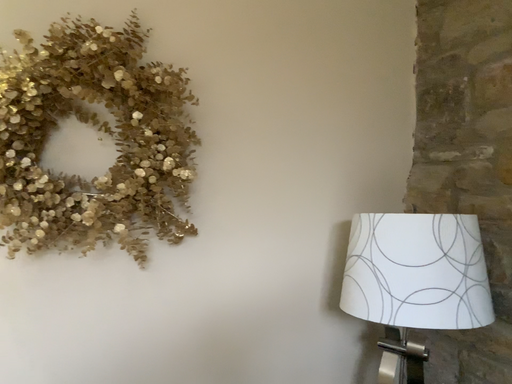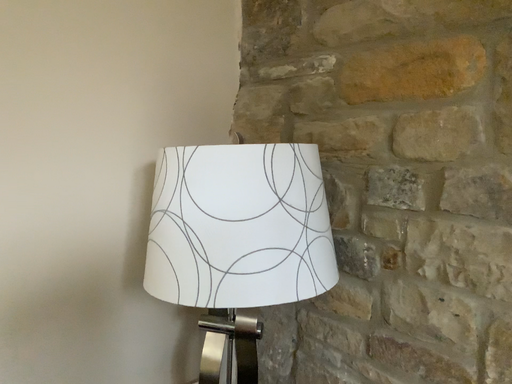
Question: Which way did the camera rotate in the video?

Choices:
 (A) rotated left
 (B) rotated right

Answer: (B)